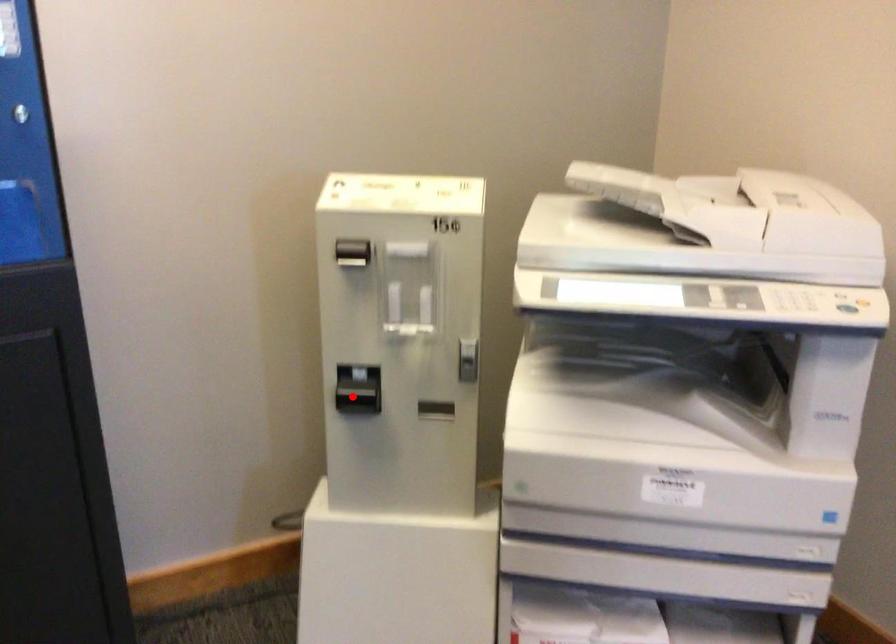
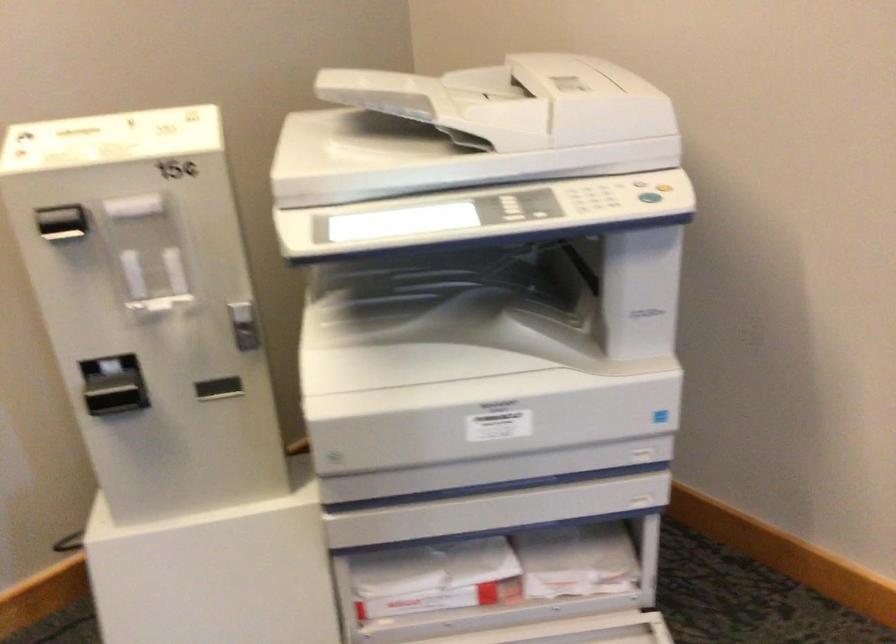
In the second image, find the point that corresponds to the highlighted location in the first image.

(115, 393)